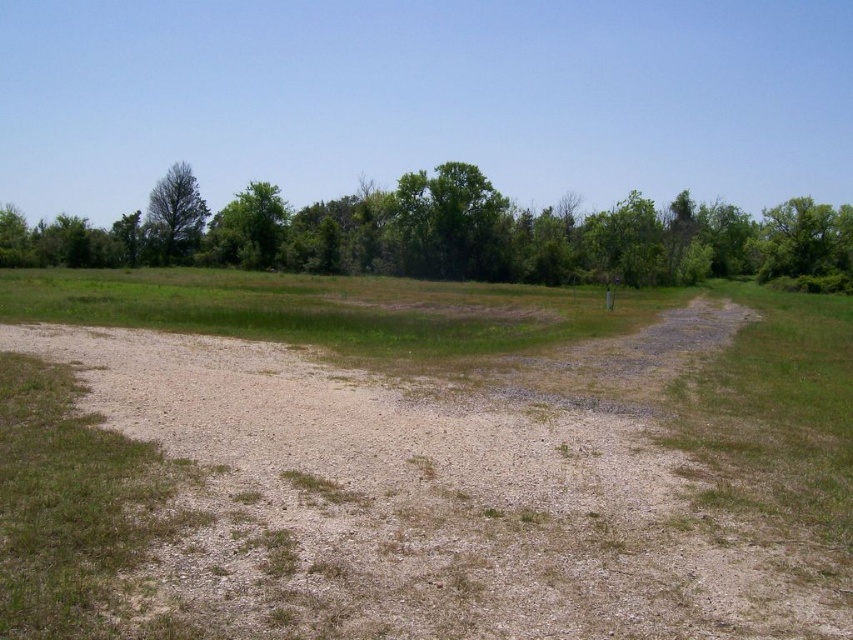
Question: In this image, where is green leafy tree at right located relative to green leafy tree at left?

Choices:
 (A) below
 (B) above

Answer: (A)

Question: Does green leafy tree at upper center come behind green leafy tree at center?

Choices:
 (A) yes
 (B) no

Answer: (B)

Question: Which point is farther to the camera?

Choices:
 (A) (843, 230)
 (B) (166, 252)
 (C) (259, 369)

Answer: (B)

Question: In this image, where is green leafy tree at upper center located relative to green leafy tree at center?

Choices:
 (A) right
 (B) left

Answer: (B)

Question: Which object is the farthest from the green leafy tree at right?

Choices:
 (A) green leafy tree at center
 (B) green leafy tree at upper center
 (C) brown gravel dirt track at center

Answer: (C)

Question: Which of the following is the farthest from the observer?

Choices:
 (A) (434, 259)
 (B) (194, 195)
 (C) (167, 172)

Answer: (B)